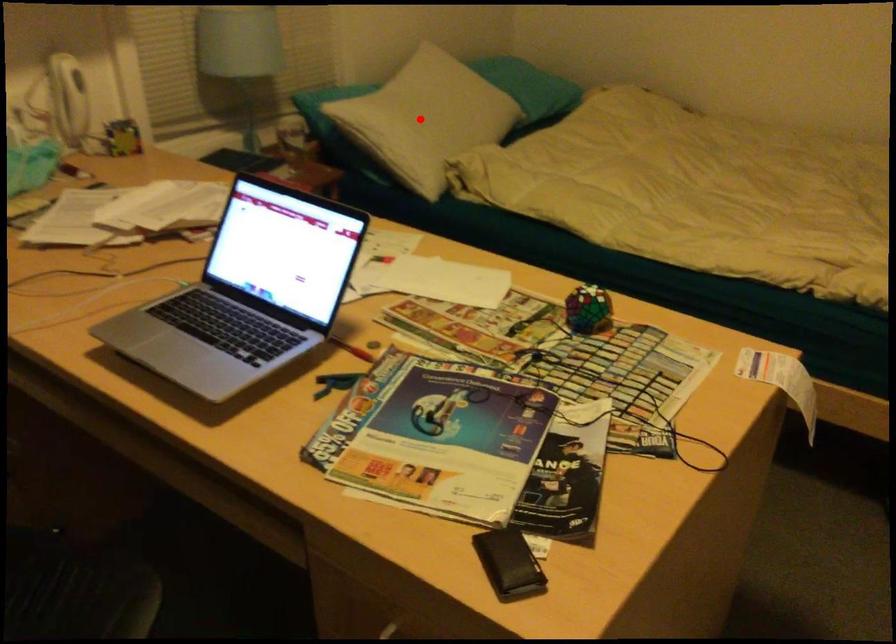
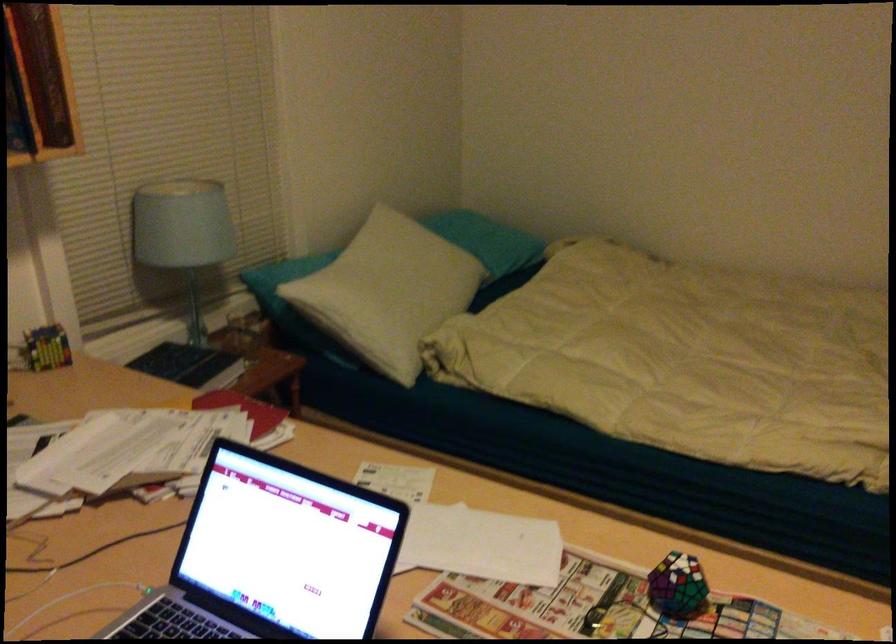
Question: I am providing you with two images of the same scene from different viewpoints. Given a red point in image1, look at the same physical point in image2. Is it:

Choices:
 (A) Closer to the viewpoint
 (B) Farther from the viewpoint

Answer: (A)